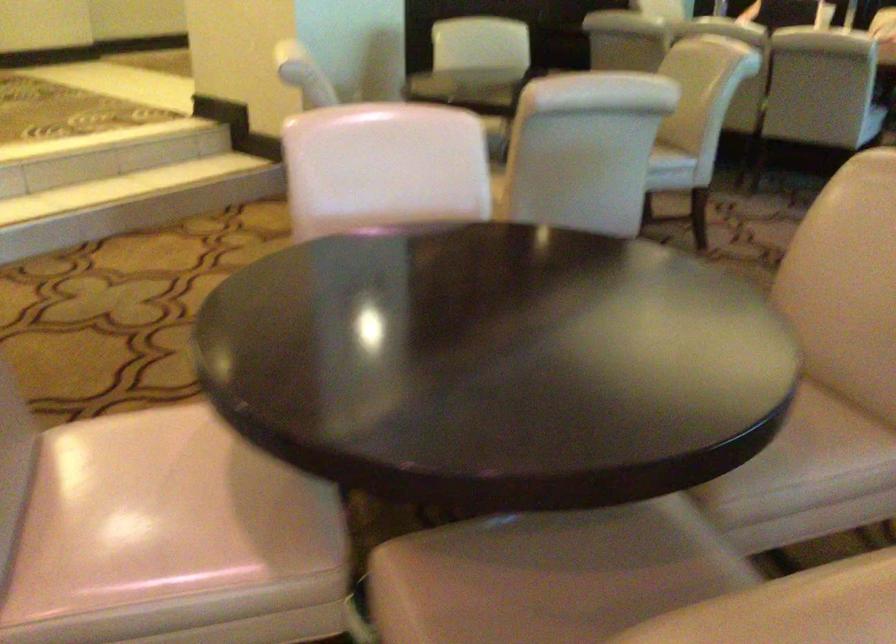
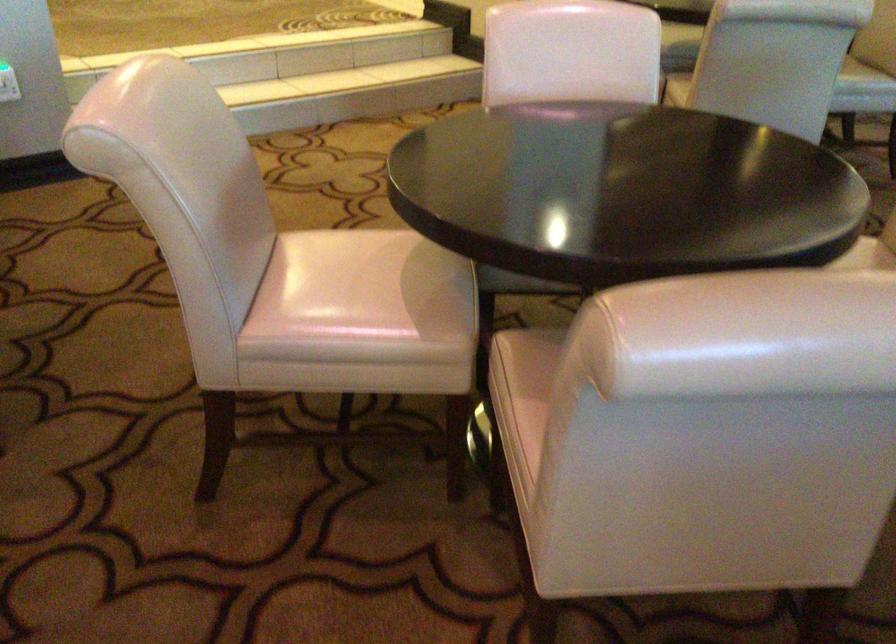
Where in the second image is the point corresponding to pixel 158 491 from the first image?

(347, 278)